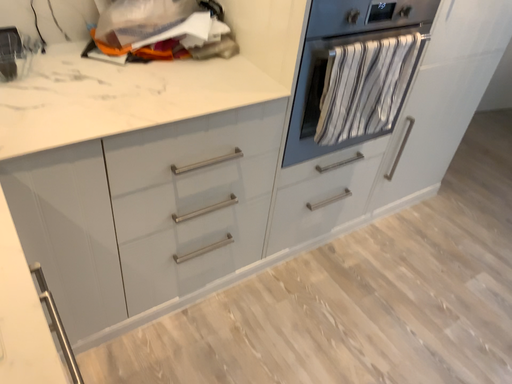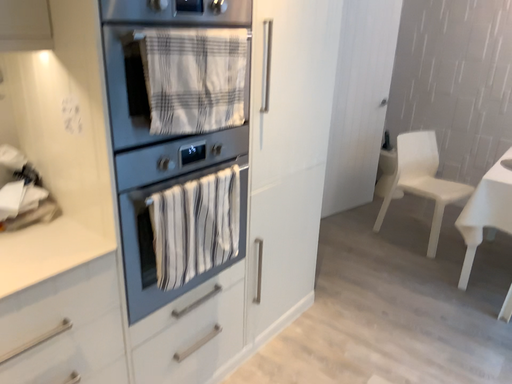
Question: Which way did the camera rotate in the video?

Choices:
 (A) rotated downward
 (B) rotated upward

Answer: (B)